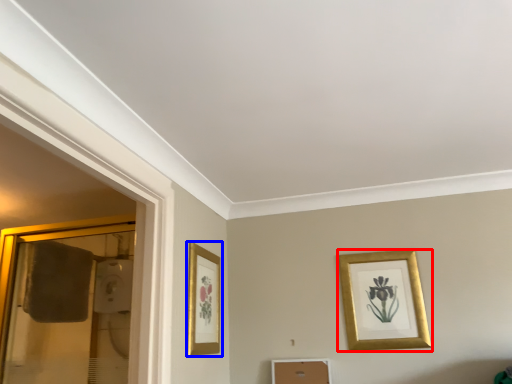
Question: Which object is further to the camera taking this photo, picture frame (highlighted by a red box) or picture frame (highlighted by a blue box)?

Choices:
 (A) picture frame
 (B) picture frame

Answer: (A)